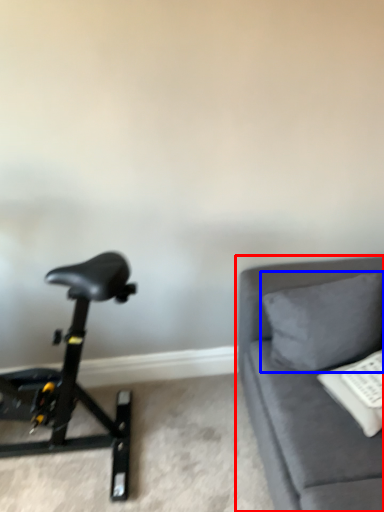
Question: Among these objects, which one is farthest to the camera, studio couch (highlighted by a red box) or pillow (highlighted by a blue box)?

Choices:
 (A) studio couch
 (B) pillow

Answer: (B)